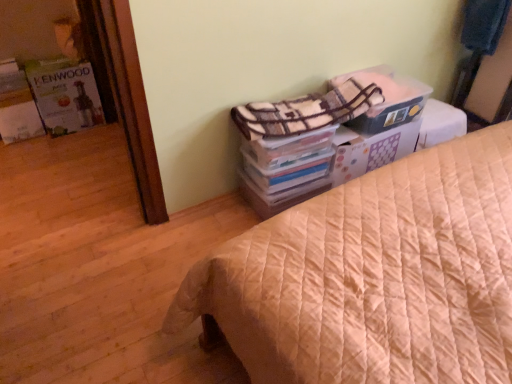
Locate an element on the screen. The image size is (512, 384). matte white kenwood appliance at left is located at coordinates (65, 95).

I want to click on white cardboard box at upper right, so click(x=387, y=102).

Image resolution: width=512 pixels, height=384 pixels. What do you see at coordinates (306, 111) in the screenshot?
I see `plaid fabric blanket at upper right, which ranks as the 2th blanket in top-to-bottom order` at bounding box center [306, 111].

The height and width of the screenshot is (384, 512). What do you see at coordinates (484, 24) in the screenshot?
I see `plaid fabric blanket at upper right, the first blanket when ordered from right to left` at bounding box center [484, 24].

Image resolution: width=512 pixels, height=384 pixels. What do you see at coordinates (374, 276) in the screenshot?
I see `beige quilted bed at center` at bounding box center [374, 276].

Where is `matte white kenwood appliance at left`? matte white kenwood appliance at left is located at coordinates (65, 95).

From the image's perspective, which one is positioned higher, plaid fabric blanket at upper right, which is counted as the second blanket, starting from the back, or matte white kenwood appliance at left?

matte white kenwood appliance at left.

Is plaid fabric blanket at upper right, marked as the 1th blanket in a left-to-right arrangement, inside or outside of matte white kenwood appliance at left?

plaid fabric blanket at upper right, marked as the 1th blanket in a left-to-right arrangement, is located beyond the bounds of matte white kenwood appliance at left.

Is the depth of plaid fabric blanket at upper right, which appears as the first blanket when viewed from the front, greater than that of matte white kenwood appliance at left?

That is False.

Who is shorter, plaid fabric blanket at upper right, which ranks as the 2th blanket in top-to-bottom order, or matte white kenwood appliance at left?

plaid fabric blanket at upper right, which ranks as the 2th blanket in top-to-bottom order.

From the picture: Does plaid fabric blanket at upper right, which is the 2th blanket in front-to-back order, turn towards white cardboard box at upper right?

No, plaid fabric blanket at upper right, which is the 2th blanket in front-to-back order, is not aimed at white cardboard box at upper right.

Which object is further away from the camera, plaid fabric blanket at upper right, acting as the second blanket starting from the bottom, or white cardboard box at upper right?

plaid fabric blanket at upper right, acting as the second blanket starting from the bottom, is further from the camera.

Can you confirm if plaid fabric blanket at upper right, the first blanket when ordered from right to left, is bigger than white cardboard box at upper right?

Indeed, plaid fabric blanket at upper right, the first blanket when ordered from right to left, has a larger size compared to white cardboard box at upper right.

Considering the sizes of objects beige quilted bed at center and plaid fabric blanket at upper right, which is counted as the second blanket, starting from the back, in the image provided, who is thinner, beige quilted bed at center or plaid fabric blanket at upper right, which is counted as the second blanket, starting from the back,?

plaid fabric blanket at upper right, which is counted as the second blanket, starting from the back, is thinner.

Is beige quilted bed at center oriented away from plaid fabric blanket at upper right, which is the second blanket in right-to-left order?

Yes, plaid fabric blanket at upper right, which is the second blanket in right-to-left order, is at the back of beige quilted bed at center.

Who is more distant, beige quilted bed at center or plaid fabric blanket at upper right, which is the first blanket from bottom to top?

plaid fabric blanket at upper right, which is the first blanket from bottom to top.

Is beige quilted bed at center to the left or to the right of plaid fabric blanket at upper right, which appears as the first blanket when viewed from the front, in the image?

In the image, beige quilted bed at center appears on the right side of plaid fabric blanket at upper right, which appears as the first blanket when viewed from the front.

Considering the sizes of objects matte white kenwood appliance at left and beige quilted bed at center in the image provided, who is shorter, matte white kenwood appliance at left or beige quilted bed at center?

matte white kenwood appliance at left.

Is matte white kenwood appliance at left inside or outside of beige quilted bed at center?

matte white kenwood appliance at left is not enclosed by beige quilted bed at center.

Is matte white kenwood appliance at left facing towards beige quilted bed at center?

Yes, matte white kenwood appliance at left is oriented towards beige quilted bed at center.

Is matte white kenwood appliance at left in front of or behind beige quilted bed at center in the image?

In the image, matte white kenwood appliance at left appears behind beige quilted bed at center.

Between white cardboard box at upper right and matte white kenwood appliance at left, which one has smaller width?

Thinner between the two is matte white kenwood appliance at left.

Which is behind, white cardboard box at upper right or matte white kenwood appliance at left?

matte white kenwood appliance at left is further away from the camera.

Is matte white kenwood appliance at left at the back of white cardboard box at upper right?

white cardboard box at upper right is not turned away from matte white kenwood appliance at left.

Is white cardboard box at upper right directly adjacent to matte white kenwood appliance at left?

They are not placed beside each other.

Between white cardboard box at upper right and plaid fabric blanket at upper right, which ranks as the 2th blanket in top-to-bottom order, which one appears on the left side from the viewer's perspective?

plaid fabric blanket at upper right, which ranks as the 2th blanket in top-to-bottom order.

Does white cardboard box at upper right have a lesser height compared to plaid fabric blanket at upper right, which is the second blanket in right-to-left order?

No, white cardboard box at upper right is not shorter than plaid fabric blanket at upper right, which is the second blanket in right-to-left order.

From the image's perspective, which one is positioned lower, white cardboard box at upper right or plaid fabric blanket at upper right, which is the first blanket from bottom to top?

plaid fabric blanket at upper right, which is the first blanket from bottom to top.

Is the surface of white cardboard box at upper right in direct contact with plaid fabric blanket at upper right, which is the second blanket in right-to-left order?

No, white cardboard box at upper right is not making contact with plaid fabric blanket at upper right, which is the second blanket in right-to-left order.

Would you say matte white kenwood appliance at left is outside plaid fabric blanket at upper right, which appears as the first blanket when viewed from the front?

matte white kenwood appliance at left is positioned outside plaid fabric blanket at upper right, which appears as the first blanket when viewed from the front.

From a real-world perspective, between matte white kenwood appliance at left and plaid fabric blanket at upper right, which is the first blanket from bottom to top, who is vertically higher?

In real-world perspective, plaid fabric blanket at upper right, which is the first blanket from bottom to top, is above.

Which object is further away from the camera, matte white kenwood appliance at left or plaid fabric blanket at upper right, which ranks as the 2th blanket in top-to-bottom order?

Positioned behind is matte white kenwood appliance at left.

From the image's perspective, between matte white kenwood appliance at left and plaid fabric blanket at upper right, which ranks as the 2th blanket in top-to-bottom order, which one is located above?

matte white kenwood appliance at left, from the image's perspective.

Locate an element on the screen. magazine to the left of plaid fabric blanket at upper right, marked as the 1th blanket in a left-to-right arrangement is located at coordinates (65, 95).

You are a GUI agent. You are given a task and a screenshot of the screen. Output one action in this format:
    pyautogui.click(x=<x>, y=<y>)
    Task: Click on the blanket behind the white cardboard box at upper right
    The image size is (512, 384).
    Given the screenshot: What is the action you would take?
    pyautogui.click(x=484, y=24)

Estimate the real-world distances between objects in this image. Which object is further from beige quilted bed at center, white cardboard box at upper right or plaid fabric blanket at upper right, which appears as the first blanket when viewed from the front?

white cardboard box at upper right is positioned further to the anchor beige quilted bed at center.

Looking at the image, which one is located further to plaid fabric blanket at upper right, acting as the first blanket starting from the back, matte white kenwood appliance at left or plaid fabric blanket at upper right, which ranks as the 2th blanket in top-to-bottom order?

Based on the image, matte white kenwood appliance at left appears to be further to plaid fabric blanket at upper right, acting as the first blanket starting from the back.

Estimate the real-world distances between objects in this image. Which object is further from plaid fabric blanket at upper right, positioned as the 1th blanket in top-to-bottom order, plaid fabric blanket at upper right, which is the second blanket in right-to-left order, or white cardboard box at upper right?

plaid fabric blanket at upper right, which is the second blanket in right-to-left order, is further to plaid fabric blanket at upper right, positioned as the 1th blanket in top-to-bottom order.

Based on their spatial positions, is matte white kenwood appliance at left or white cardboard box at upper right closer to plaid fabric blanket at upper right, positioned as the 1th blanket in top-to-bottom order?

white cardboard box at upper right lies closer to plaid fabric blanket at upper right, positioned as the 1th blanket in top-to-bottom order, than the other object.

Considering their positions, is matte white kenwood appliance at left positioned further to plaid fabric blanket at upper right, which appears as the first blanket when viewed from the front, than beige quilted bed at center?

Among the two, matte white kenwood appliance at left is located further to plaid fabric blanket at upper right, which appears as the first blanket when viewed from the front.

Looking at the image, which one is located further to plaid fabric blanket at upper right, which is the first blanket from bottom to top, white cardboard box at upper right or plaid fabric blanket at upper right, positioned as the 1th blanket in top-to-bottom order?

Among the two, plaid fabric blanket at upper right, positioned as the 1th blanket in top-to-bottom order, is located further to plaid fabric blanket at upper right, which is the first blanket from bottom to top.

Which object lies further to the anchor point plaid fabric blanket at upper right, the first blanket when ordered from right to left, beige quilted bed at center or white cardboard box at upper right?

beige quilted bed at center.

Based on their spatial positions, is matte white kenwood appliance at left or plaid fabric blanket at upper right, which ranks as the 2th blanket in top-to-bottom order, closer to beige quilted bed at center?

plaid fabric blanket at upper right, which ranks as the 2th blanket in top-to-bottom order, is positioned closer to the anchor beige quilted bed at center.

At what (x,y) coordinates should I click in order to perform the action: click on blanket located between matte white kenwood appliance at left and white cardboard box at upper right in the left-right direction. Please return your answer as a coordinate pair (x, y). The image size is (512, 384). Looking at the image, I should click on (306, 111).

Where is `bed located between matte white kenwood appliance at left and plaid fabric blanket at upper right, the first blanket when ordered from right to left, in the left-right direction`? The image size is (512, 384). bed located between matte white kenwood appliance at left and plaid fabric blanket at upper right, the first blanket when ordered from right to left, in the left-right direction is located at coordinates pos(374,276).

I want to click on cardboard box situated between plaid fabric blanket at upper right, which is counted as the second blanket, starting from the back, and plaid fabric blanket at upper right, which is the 2th blanket in front-to-back order, from left to right, so click(x=387, y=102).

Image resolution: width=512 pixels, height=384 pixels. I want to click on cardboard box between matte white kenwood appliance at left and plaid fabric blanket at upper right, acting as the second blanket starting from the bottom, so click(387, 102).